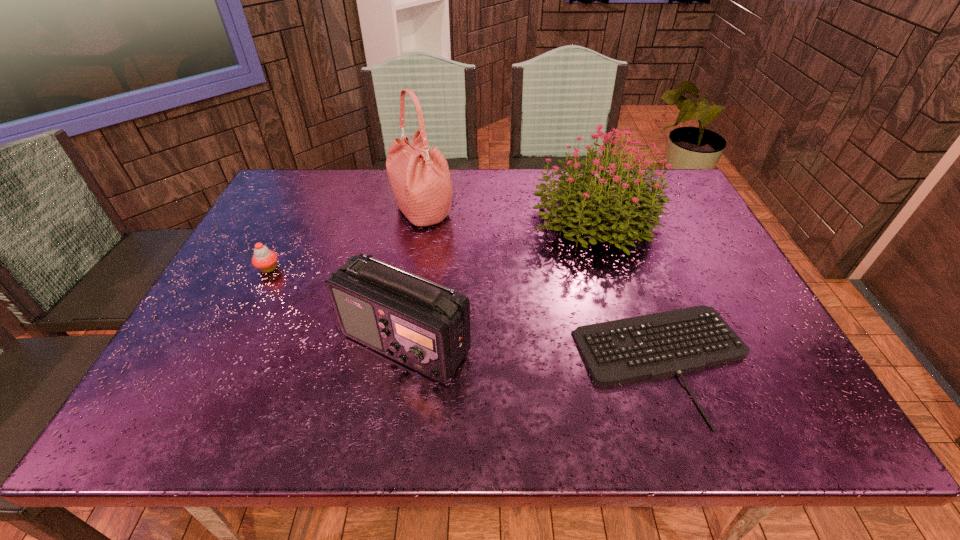
The height and width of the screenshot is (540, 960). Identify the location of vacant space that satisfies the following two spatial constraints: 1. on the front panel of the computer keyboard; 2. on the right side of the radio receiver. (403, 361).

Image resolution: width=960 pixels, height=540 pixels. I want to click on vacant space that satisfies the following two spatial constraints: 1. on the back side of the leftmost object; 2. on the left side of the handbag, so click(x=298, y=211).

You are a GUI agent. You are given a task and a screenshot of the screen. Output one action in this format:
    pyautogui.click(x=<x>, y=<y>)
    Task: Click on the free location that satisfies the following two spatial constraints: 1. on the front panel of the shortest object; 2. on the right side of the radio receiver
    This screenshot has height=540, width=960.
    Given the screenshot: What is the action you would take?
    pyautogui.click(x=403, y=361)

Where is `free point that satisfies the following two spatial constraints: 1. on the front side of the computer keyboard; 2. on the right side of the leftmost object`? The image size is (960, 540). free point that satisfies the following two spatial constraints: 1. on the front side of the computer keyboard; 2. on the right side of the leftmost object is located at coordinates (222, 361).

This screenshot has width=960, height=540. I want to click on blank space that satisfies the following two spatial constraints: 1. on the front side of the shortest object; 2. on the left side of the handbag, so click(x=397, y=361).

Find the location of a particular element. The width and height of the screenshot is (960, 540). free space that satisfies the following two spatial constraints: 1. on the front side of the fourth shortest object; 2. on the right side of the handbag is located at coordinates (421, 217).